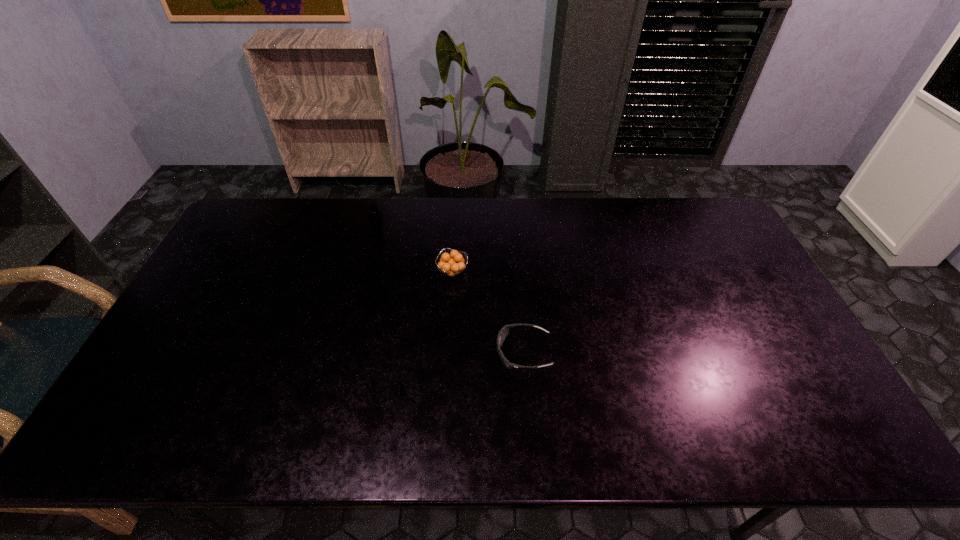
Find the location of a particular element. This screenshot has width=960, height=540. free space that satisfies the following two spatial constraints: 1. on the front-facing side of the leftmost object; 2. on the left side of the second object from right to left is located at coordinates (365, 272).

Identify the location of vacant space that satisfies the following two spatial constraints: 1. on the front-facing side of the farthest object; 2. on the left side of the orange fruit. The height and width of the screenshot is (540, 960). (365, 272).

Identify the location of vacant space that satisfies the following two spatial constraints: 1. on the front-facing side of the second farthest object; 2. on the left side of the Lego. The width and height of the screenshot is (960, 540). (365, 272).